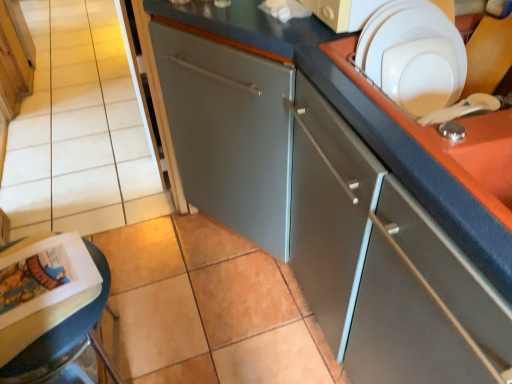
Question: Would you say matte paper magazine at lower left is to the left or to the right of satin gray cabinet at center, the 2th cabinetry when ordered from left to right, in the picture?

Choices:
 (A) left
 (B) right

Answer: (A)

Question: Which is correct: matte paper magazine at lower left is inside satin gray cabinet at center, the 2th cabinetry positioned from the top, or outside of it?

Choices:
 (A) outside
 (B) inside

Answer: (A)

Question: Which object is the closest to the satin gray cabinet at center, which is the 1th cabinetry in right-to-left order?

Choices:
 (A) matte wood cabinet at upper left, placed as the second cabinetry when sorted from bottom to top
 (B) white glossy plate at upper right
 (C) white glossy sink at upper right
 (D) matte paper magazine at lower left

Answer: (C)

Question: Based on their relative distances, which object is farther from the matte paper magazine at lower left?

Choices:
 (A) matte wood cabinet at upper left, acting as the 2th cabinetry starting from the right
 (B) white glossy sink at upper right
 (C) satin gray cabinet at center, which is counted as the 1th cabinetry, starting from the bottom
 (D) white glossy plate at upper right

Answer: (A)